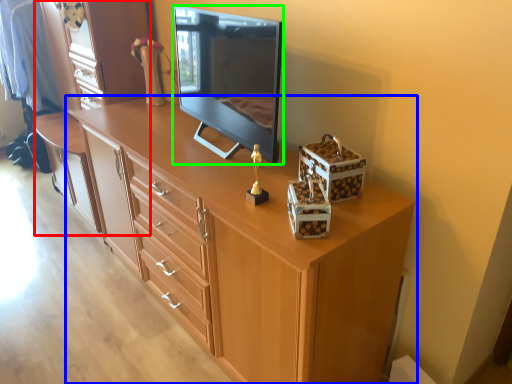
Question: Which is nearer to the dresser (highlighted by a red box)? chest of drawers (highlighted by a blue box) or television (highlighted by a green box).

Choices:
 (A) chest of drawers
 (B) television

Answer: (B)